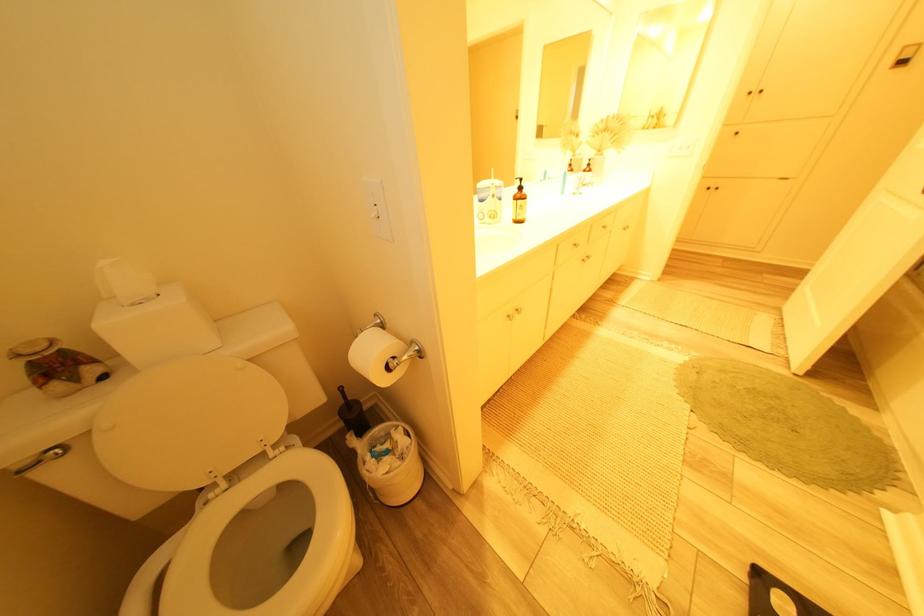
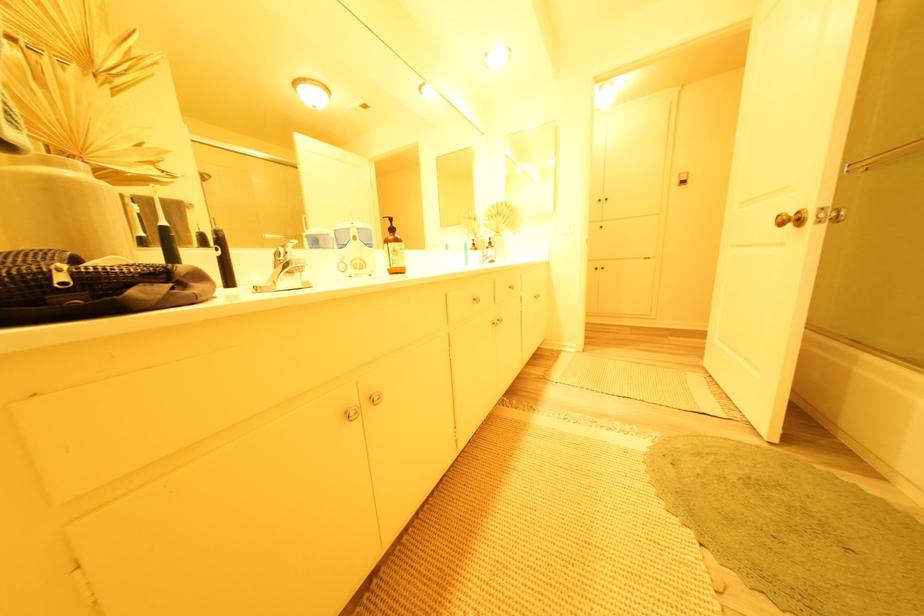
Where in the second image is the point corresponding to point 529,201 from the first image?

(399, 245)